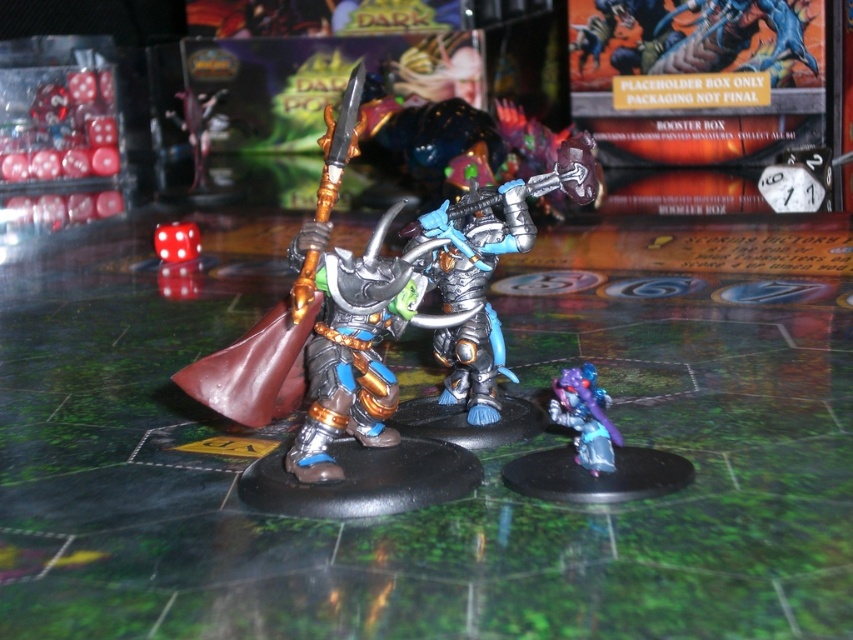
You are setting up a tabletop game and need to place the translucent red dice at left and the white plastic die at center on the game mat. The game rules state that the larger object must be placed closer to the players. Which object should you place closer to the players?

The translucent red dice at left is larger than the white plastic die at center, so you should place the translucent red dice at left closer to the players as per the game rules.

You are setting up a tabletop game and need to place the translucent red dice at left and the white plastic die at center on the game board. The game rules state that the wider object must be placed in the designated area marked for larger items. Which object should you place in the larger item area?

The translucent red dice at left should be placed in the designated area for larger items because its width surpasses that of the white plastic die at center.

You are a game master preparing a tabletop game. You have two dice sets, the translucent red dice at left and the white matte dice at left. The game rules state that these two dice must be placed at least 20 inches apart to avoid interference. Based on the scene description, can you confirm if the current placement meets the rule requirements?

The distance between the translucent red dice at left and white matte dice at left is 20.53 inches, which exceeds the minimum requirement of 20 inches. Therefore, the current placement meets the rule requirements.